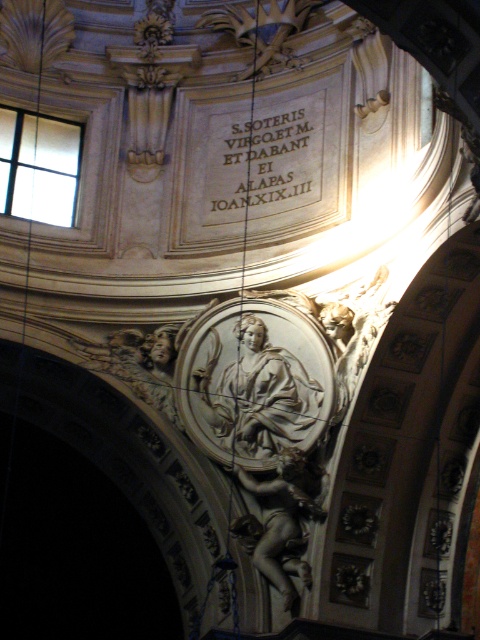
In the scene shown: You are an architect analyzing the symmetry of the ceiling. The silver metallic statue at center is represented by point (256, 394). Is this point the exact center of the ceiling?

The silver metallic statue at center is represented by point (256, 394). Therefore, this point is the exact center of the ceiling.

From the picture: You are an architect examining the ornate ceiling. You notice two points marked on the design blueprint. The first point is at coordinates point (251, 161), and the second is at point (274, 486). From your vantage point below, which point appears closer to you?

Point (274, 486) appears closer because it is in front of point (251, 161) according to the description.